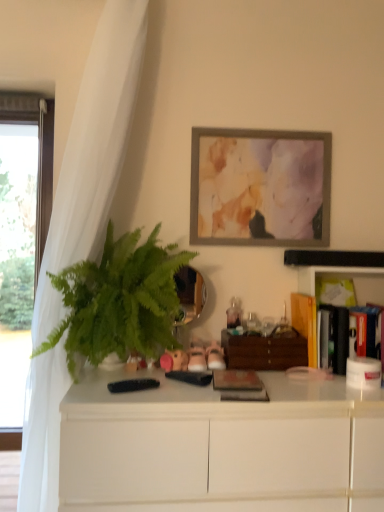
The image size is (384, 512). Identify the location of free space in front of pink fabric stuffed animal at center. (165, 394).